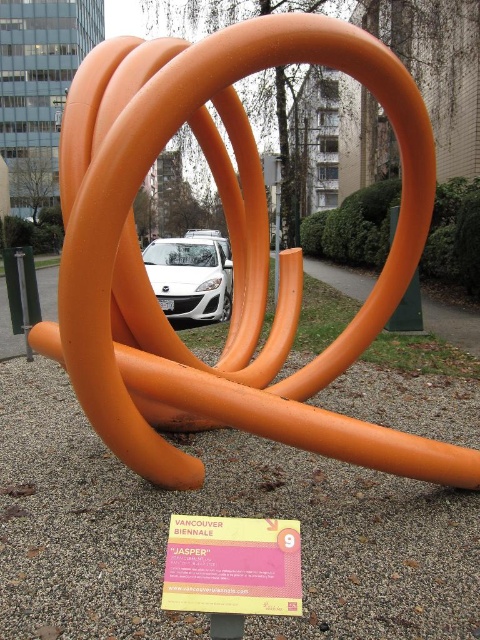
You are standing in front of the sculpture and want to take a photo of the white glossy car at center without the orange matte sculpture at center blocking the view. Which direction should you move to ensure the car is visible without the sculpture in the frame?

Move to the left side of the orange matte sculpture at center so that the white glossy car at center is visible without obstruction from the sculpture, as the sculpture is to the right of the car.

You are standing at the center of the image and want to locate the orange matte sculpture at center. According to the coordinates provided, is it positioned closer to the top or bottom half of the image?

The orange matte sculpture at center is positioned at coordinates point 0.490 on the vertical axis, which places it closer to the bottom half of the image since 0.490 is just below the midpoint of 0.5.